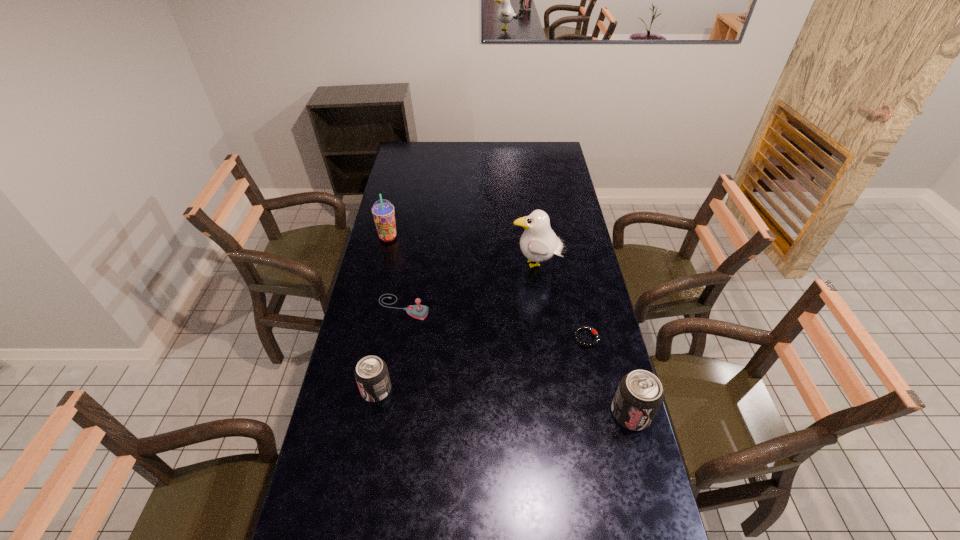
Where is `free space between the fifth tallest object and the third shortest object`? The height and width of the screenshot is (540, 960). free space between the fifth tallest object and the third shortest object is located at coordinates (390, 348).

Locate an element on the screen. This screenshot has width=960, height=540. free point between the third tallest object and the fourth farthest object is located at coordinates (609, 376).

Identify the location of empty space between the tallest object and the joystick. Image resolution: width=960 pixels, height=540 pixels. (470, 286).

This screenshot has height=540, width=960. What are the coordinates of `vacant point located between the fourth tallest object and the second farthest object` in the screenshot? It's located at (457, 328).

Identify the location of free spot between the smoothie and the third farthest object. (396, 272).

Where is `free area in between the taller soda can and the fifth nearest object`? The height and width of the screenshot is (540, 960). free area in between the taller soda can and the fifth nearest object is located at coordinates (584, 340).

You are a GUI agent. You are given a task and a screenshot of the screen. Output one action in this format:
    pyautogui.click(x=<x>, y=<y>)
    Task: Click on the free space between the joystick and the gull
    
    Given the screenshot: What is the action you would take?
    pyautogui.click(x=470, y=286)

At what (x,y) coordinates should I click in order to perform the action: click on vacant space in between the left soda can and the third nearest object. Please return your answer as a coordinate pair (x, y). The image size is (960, 540). Looking at the image, I should click on (481, 364).

Where is `vacant point located between the shortest object and the joystick`? The width and height of the screenshot is (960, 540). vacant point located between the shortest object and the joystick is located at coordinates (494, 322).

Image resolution: width=960 pixels, height=540 pixels. Identify the location of object that stands as the third closest to the fourth farthest object. (418, 311).